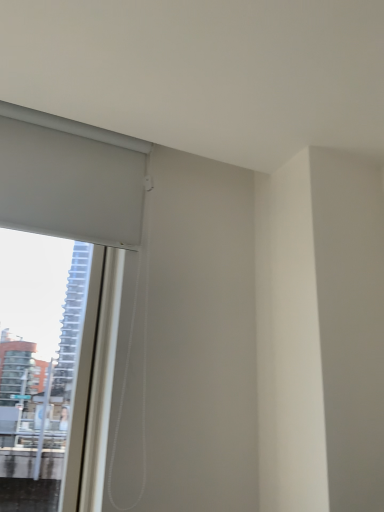
What do you see at coordinates (71, 179) in the screenshot?
I see `white matte window at upper left` at bounding box center [71, 179].

Measure the distance between white matte window at upper left and camera.

white matte window at upper left is 4.08 feet away from camera.

Where is `white matte window at upper left`? The width and height of the screenshot is (384, 512). white matte window at upper left is located at coordinates (71, 179).

Where is `white matte window at upper left`? The image size is (384, 512). white matte window at upper left is located at coordinates (71, 179).